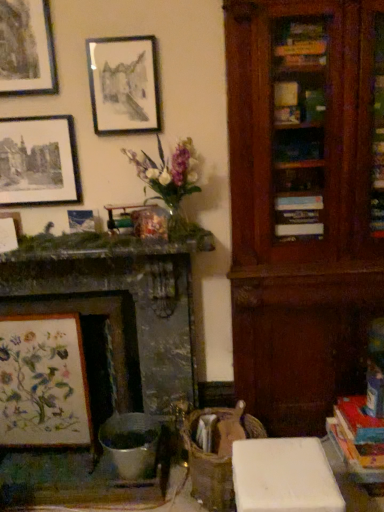
Question: Considering the relative sizes of metallic silver picture frame at upper left, the third picture frame ordered from the bottom, and matte black picture frame at upper left, the 4th picture frame in the bottom-to-top sequence, in the image provided, is metallic silver picture frame at upper left, the third picture frame ordered from the bottom, smaller than matte black picture frame at upper left, the 4th picture frame in the bottom-to-top sequence,?

Choices:
 (A) yes
 (B) no

Answer: (A)

Question: Is metallic silver picture frame at upper left, the third picture frame ordered from the bottom, not near matte black picture frame at upper left, the 4th picture frame in the bottom-to-top sequence?

Choices:
 (A) yes
 (B) no

Answer: (B)

Question: From a real-world perspective, is metallic silver picture frame at upper left, the fourth picture frame viewed from the top, on matte black picture frame at upper left, the 4th picture frame in the bottom-to-top sequence?

Choices:
 (A) yes
 (B) no

Answer: (B)

Question: Is metallic silver picture frame at upper left, the fourth picture frame viewed from the top, to the left of matte black picture frame at upper left, the third picture frame viewed from the top, from the viewer's perspective?

Choices:
 (A) no
 (B) yes

Answer: (A)

Question: Is the surface of metallic silver picture frame at upper left, the third picture frame ordered from the bottom, in direct contact with matte black picture frame at upper left, the third picture frame viewed from the top?

Choices:
 (A) no
 (B) yes

Answer: (A)

Question: Does metallic silver picture frame at upper left, the fourth picture frame viewed from the top, come in front of matte black picture frame at upper left, the third picture frame viewed from the top?

Choices:
 (A) yes
 (B) no

Answer: (B)

Question: From the image's perspective, is hardcover book at lower right under matte black picture frame at upper left, the 4th picture frame in the bottom-to-top sequence?

Choices:
 (A) yes
 (B) no

Answer: (A)

Question: Would you say hardcover book at lower right is a long distance from matte black picture frame at upper left, the third picture frame viewed from the top?

Choices:
 (A) yes
 (B) no

Answer: (A)

Question: From a real-world perspective, does hardcover book at lower right stand above matte black picture frame at upper left, the third picture frame viewed from the top?

Choices:
 (A) yes
 (B) no

Answer: (B)

Question: From the image's perspective, is hardcover book at lower right located above matte black picture frame at upper left, the third picture frame viewed from the top?

Choices:
 (A) no
 (B) yes

Answer: (A)

Question: Considering the relative sizes of hardcover book at lower right and matte black picture frame at upper left, the third picture frame viewed from the top, in the image provided, is hardcover book at lower right thinner than matte black picture frame at upper left, the third picture frame viewed from the top,?

Choices:
 (A) yes
 (B) no

Answer: (B)

Question: Is hardcover book at lower right outside of matte black picture frame at upper left, the 4th picture frame in the bottom-to-top sequence?

Choices:
 (A) yes
 (B) no

Answer: (A)

Question: Is matte black picture frame at upper center, which is the fifth picture frame in bottom-to-top order, closer to the viewer compared to matte black picture frame at upper left, the third picture frame viewed from the top?

Choices:
 (A) no
 (B) yes

Answer: (B)